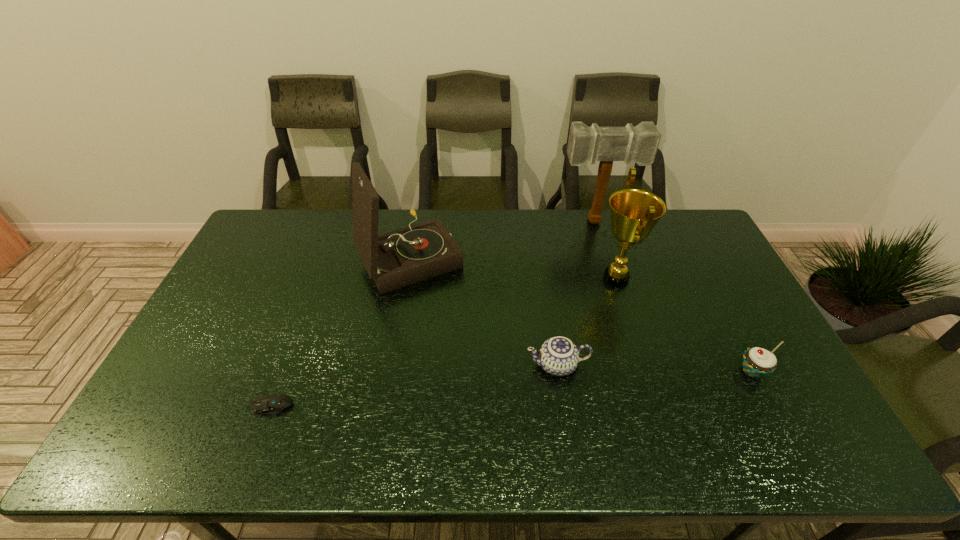
At what (x,y) coordinates should I click in order to perform the action: click on free spot that satisfies the following two spatial constraints: 1. from the spout of the chinaware; 2. on the front side of the shortest object. Please return your answer as a coordinate pair (x, y). This screenshot has width=960, height=540. Looking at the image, I should click on (564, 406).